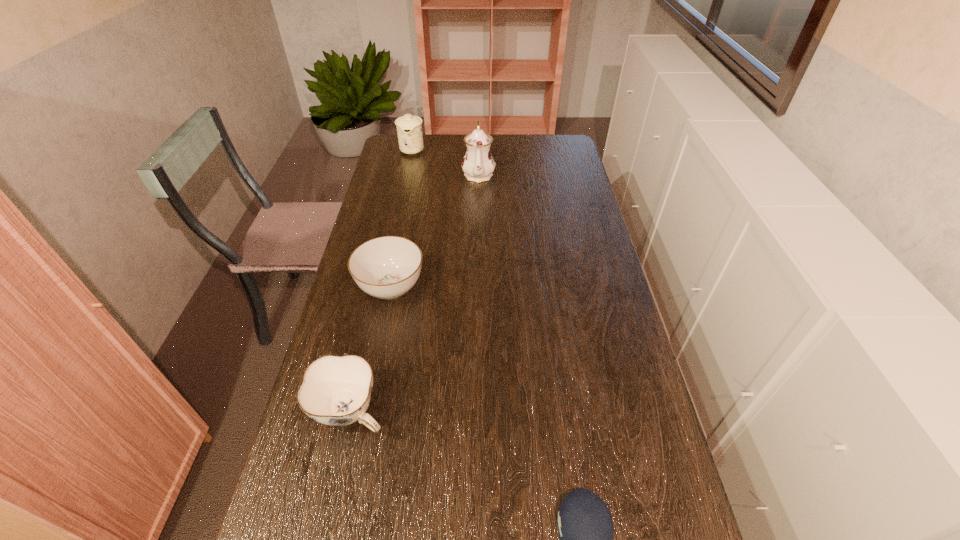
Locate an element on the screen. object present at the far left corner is located at coordinates (409, 127).

The height and width of the screenshot is (540, 960). In the image, there is a desktop. Identify the location of free region at the far edge. (448, 157).

Locate an element on the screen. vacant space at the left edge of the desktop is located at coordinates (308, 475).

In the image, there is a desktop. Where is `free region at the right edge`? free region at the right edge is located at coordinates (653, 474).

At what (x,y) coordinates should I click in order to perform the action: click on vacant area at the far right corner. Please return your answer as a coordinate pair (x, y). Looking at the image, I should click on (552, 137).

This screenshot has height=540, width=960. Identify the location of free space between the fourth farthest object and the third nearest object. (371, 349).

Where is `vacant area between the third farthest chinaware and the fourth object from left to right`? Image resolution: width=960 pixels, height=540 pixels. vacant area between the third farthest chinaware and the fourth object from left to right is located at coordinates (435, 231).

This screenshot has height=540, width=960. Identify the location of free space between the fourth farthest object and the third farthest chinaware. (371, 349).

At what (x,y) coordinates should I click in order to perform the action: click on empty space that is in between the second tallest object and the third nearest object. Please return your answer as a coordinate pair (x, y). Image resolution: width=960 pixels, height=540 pixels. Looking at the image, I should click on (401, 219).

Where is `vacant area that lies between the third nearest chinaware and the third shortest chinaware`? vacant area that lies between the third nearest chinaware and the third shortest chinaware is located at coordinates (445, 162).